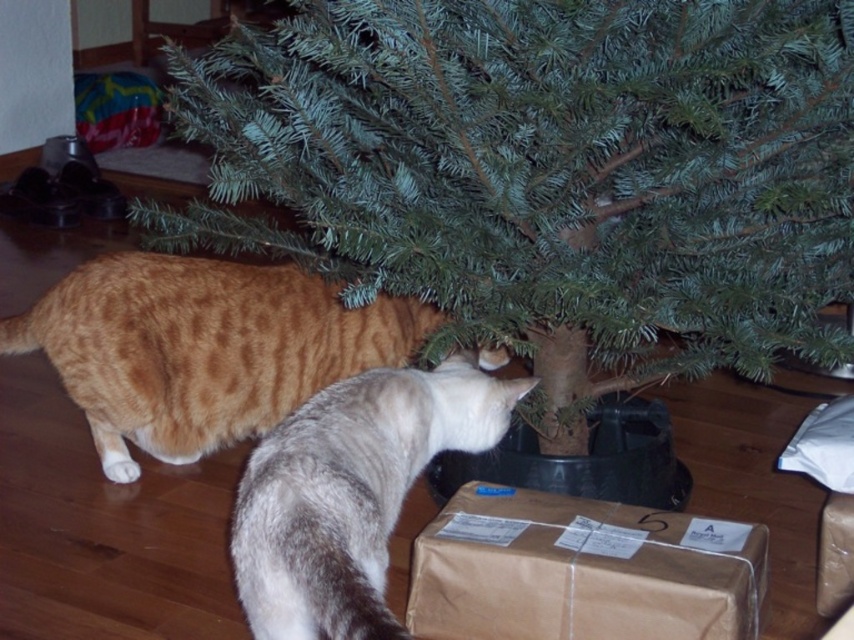
You are a cat owner who wants to ensure your cats can safely interact with the green matte tree at center. Given that the cats are curious and might approach it, what is the minimum distance you should keep the cats away from the tree to prevent them from knocking it over?

The green matte tree at center is 1.12 meters away from the viewer. To prevent the cats from knocking it over, you should keep them at least 1.12 meters away from the tree.

Based on the coordinates provided, which cat is located at point (202, 348)?

The orange tabby cat at lower left is located at point (202, 348).